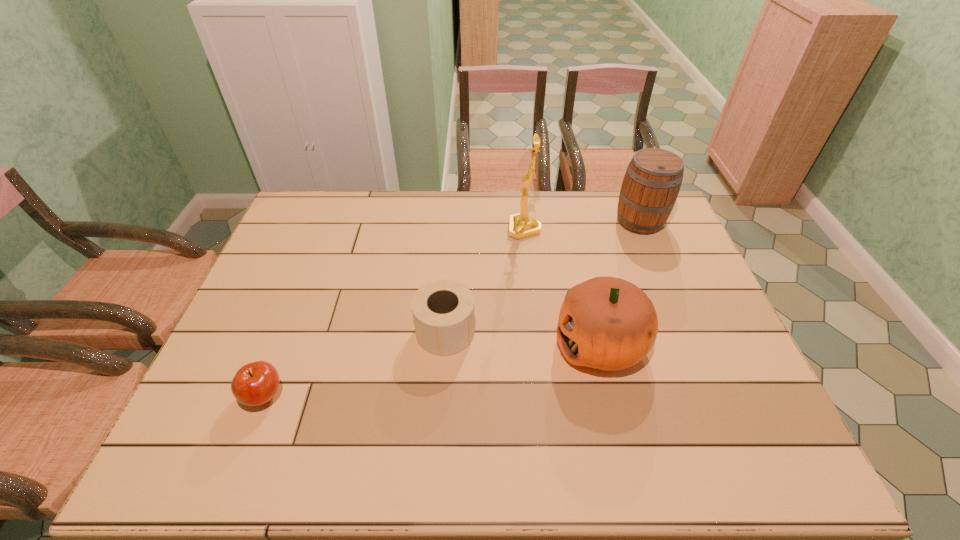
Locate an element on the screen. The width and height of the screenshot is (960, 540). vacant region located on the front-facing side of the tallest object is located at coordinates (433, 229).

Locate an element on the screen. The image size is (960, 540). free space located 0.320m on the left of the cider is located at coordinates (523, 221).

Locate an element on the screen. The image size is (960, 540). vacant position located on the face of the pumpkin is located at coordinates (438, 343).

At what (x,y) coordinates should I click in order to perform the action: click on blank space located on the face of the pumpkin. Please return your answer as a coordinate pair (x, y). The height and width of the screenshot is (540, 960). Looking at the image, I should click on (412, 343).

This screenshot has height=540, width=960. What are the coordinates of `free space located 0.310m on the face of the pumpkin` in the screenshot? It's located at (438, 343).

Where is `vacant area located on the right of the fourth tallest object`? vacant area located on the right of the fourth tallest object is located at coordinates (500, 332).

Where is `free space located 0.150m on the right of the leftmost object`? The image size is (960, 540). free space located 0.150m on the right of the leftmost object is located at coordinates (348, 396).

Identify the location of award at the far edge. The width and height of the screenshot is (960, 540). (521, 225).

Image resolution: width=960 pixels, height=540 pixels. Find the location of `cider at the far edge`. cider at the far edge is located at coordinates (650, 187).

You are a GUI agent. You are given a task and a screenshot of the screen. Output one action in this format:
    pyautogui.click(x=<x>, y=<y>)
    Task: Click on the object situated at the left edge
    
    Given the screenshot: What is the action you would take?
    pyautogui.click(x=254, y=384)